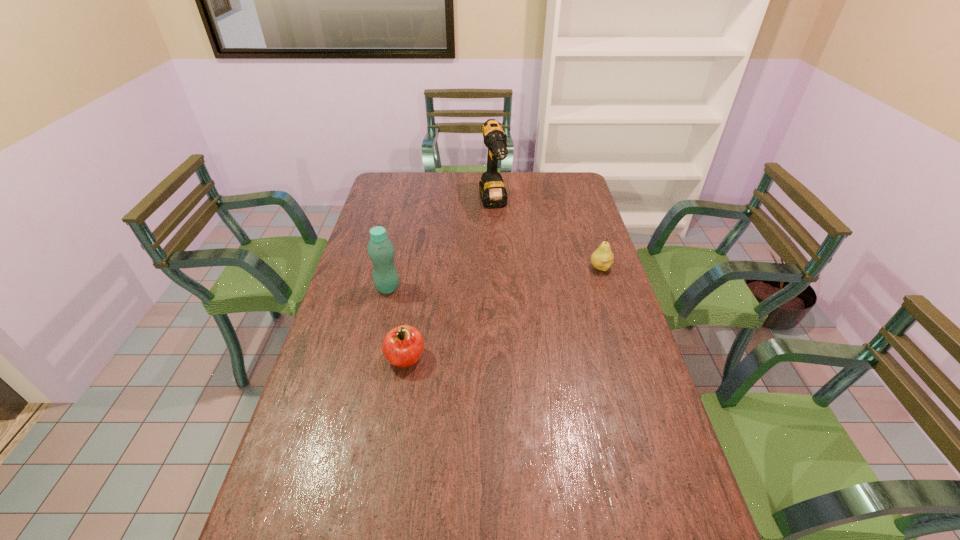
At what (x,y) coordinates should I click in order to perform the action: click on vacant area between the drill and the third nearest object. Please return your answer as a coordinate pair (x, y). This screenshot has width=960, height=540. Looking at the image, I should click on click(x=547, y=236).

Image resolution: width=960 pixels, height=540 pixels. I want to click on unoccupied area between the nearest object and the tallest object, so click(449, 281).

Where is `free spot between the farthest object and the water bottle`? The width and height of the screenshot is (960, 540). free spot between the farthest object and the water bottle is located at coordinates tap(441, 246).

The width and height of the screenshot is (960, 540). What are the coordinates of `object that is the second closest one to the second object from right to left` in the screenshot? It's located at (381, 251).

Locate which object is the closest to the water bottle. Please provide its 2D coordinates. Your answer should be formatted as a tuple, i.e. [(x, y)], where the tuple contains the x and y coordinates of a point satisfying the conditions above.

[(403, 346)]

Find the location of a particular element. Image resolution: width=960 pixels, height=540 pixels. vacant area in the image that satisfies the following two spatial constraints: 1. on the back side of the nearest object; 2. on the right side of the third nearest object is located at coordinates (420, 268).

Where is `blank area in the image that satisfies the following two spatial constraints: 1. on the back side of the third nearest object; 2. on the right side of the water bottle`? blank area in the image that satisfies the following two spatial constraints: 1. on the back side of the third nearest object; 2. on the right side of the water bottle is located at coordinates (393, 268).